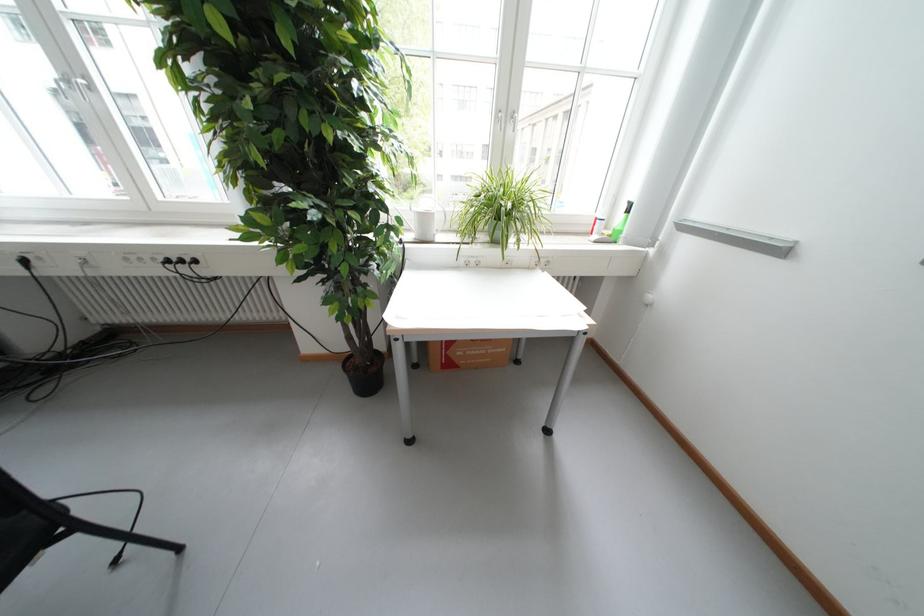
Find the location of a particular element. This screenshot has width=924, height=616. white ceramic pot is located at coordinates (503, 224).